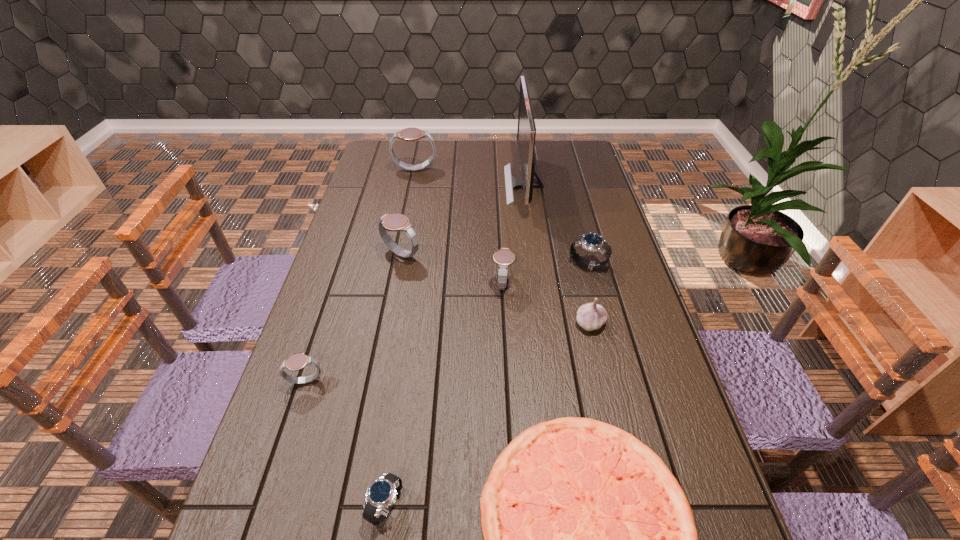
You are a GUI agent. You are given a task and a screenshot of the screen. Output one action in this format:
    pyautogui.click(x=<x>, y=<y>)
    Task: Click on the white garlic
    This screenshot has height=540, width=960.
    Given the screenshot: What is the action you would take?
    pyautogui.click(x=591, y=316)

Find the location of a particular element. Image resolution: width=960 pixels, height=540 pixels. the leftmost object is located at coordinates (298, 361).

I want to click on the seventh farthest object, so click(298, 361).

The width and height of the screenshot is (960, 540). I want to click on the nearer silver watch, so click(381, 495).

The image size is (960, 540). Find the location of `the left silver watch`. the left silver watch is located at coordinates (381, 495).

Where is `free space located 0.240m on the screen side of the tallest object`? free space located 0.240m on the screen side of the tallest object is located at coordinates (442, 185).

Where is `free spot located 0.100m on the screen side of the tallest object`? free spot located 0.100m on the screen side of the tallest object is located at coordinates pos(479,185).

The height and width of the screenshot is (540, 960). Identify the location of free region located on the screen side of the tallest object. (479, 185).

Locate an element on the screen. The image size is (960, 540). vacant space located 0.230m on the right of the farthest gray watch is located at coordinates (496, 171).

Image resolution: width=960 pixels, height=540 pixels. In order to click on vacant space located 0.140m on the right of the third nearest gray watch in this screenshot , I will do `click(468, 254)`.